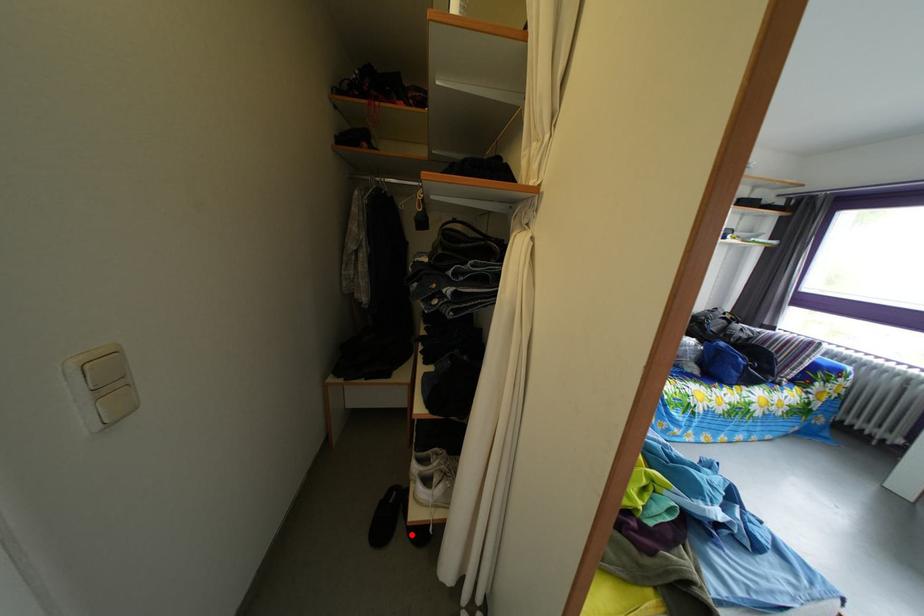
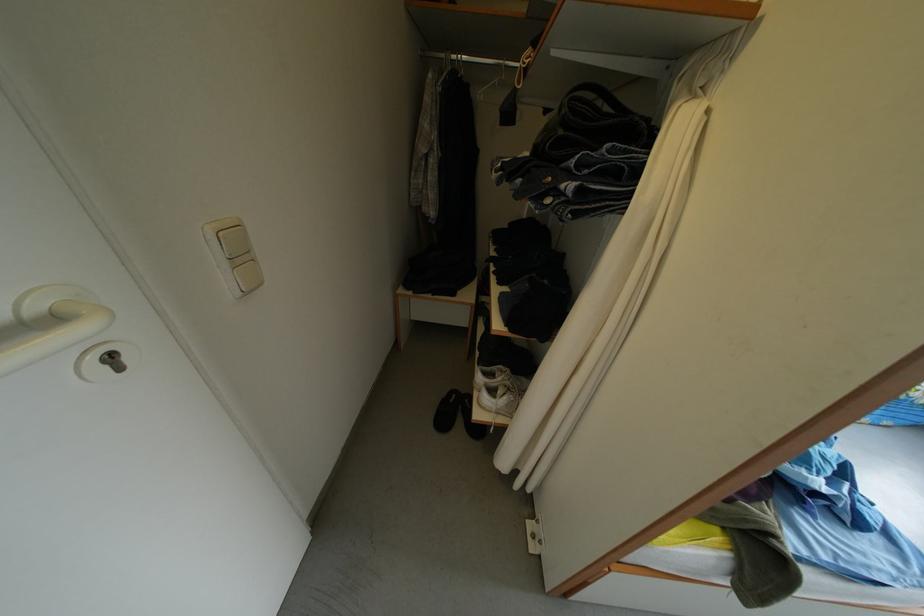
Question: I am providing you with two images of the same scene from different viewpoints. Given a red point in image1, look at the same physical point in image2. Is it:

Choices:
 (A) Closer to the viewpoint
 (B) Farther from the viewpoint

Answer: (A)